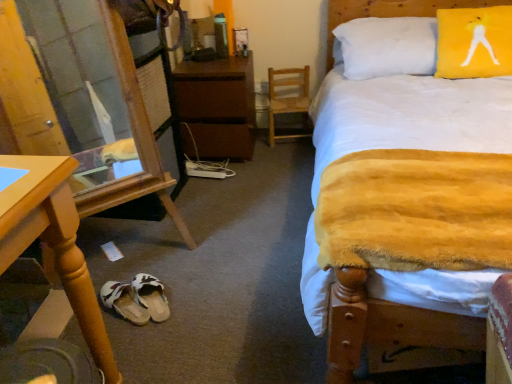
At what (x,y) coordinates should I click in order to perform the action: click on unoccupied space behind white fabric slipper at lower center, which appears as the first footwear when viewed from the right. Please return your answer as a coordinate pair (x, y). Image resolution: width=512 pixels, height=384 pixels. Looking at the image, I should click on (168, 266).